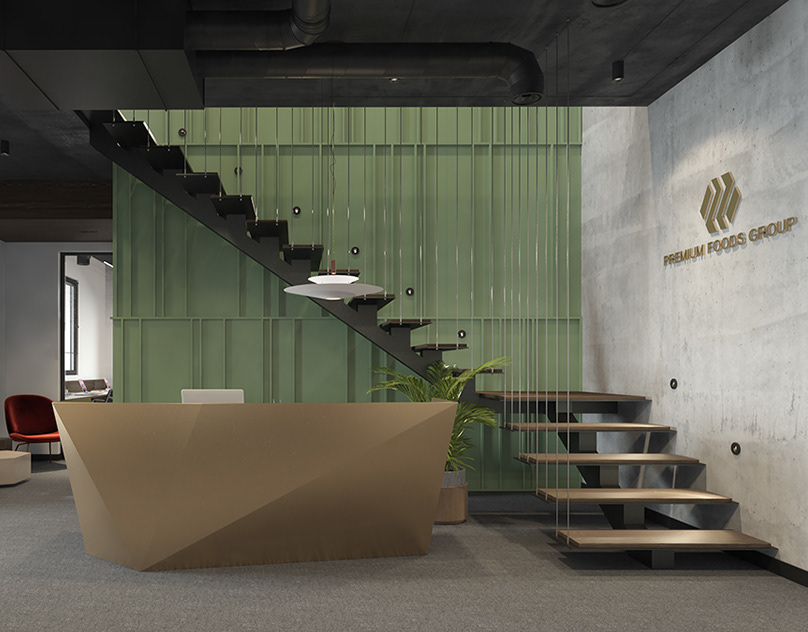
You are a GUI agent. You are given a task and a screenshot of the screen. Output one action in this format:
    pyautogui.click(x=<x>, y=<y>)
    Task: Click on the wall
    The image size is (808, 632).
    Given the screenshot: What is the action you would take?
    pyautogui.click(x=747, y=342), pyautogui.click(x=497, y=196), pyautogui.click(x=31, y=327)